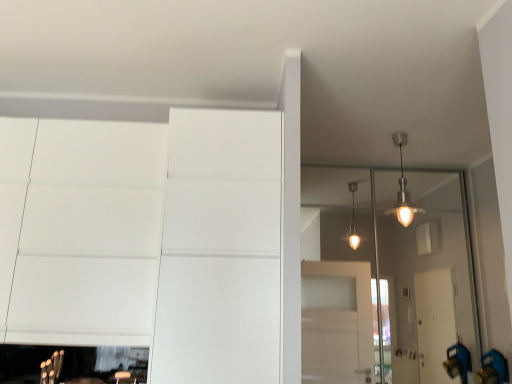
Question: Is white matte dresser at lower left taller or shorter than transparent glass door at upper right?

Choices:
 (A) short
 (B) tall

Answer: (A)

Question: From a real-world perspective, is white matte dresser at lower left above or below transparent glass door at upper right?

Choices:
 (A) below
 (B) above

Answer: (B)

Question: Is point (100, 248) closer or farther from the camera than point (453, 273)?

Choices:
 (A) farther
 (B) closer

Answer: (B)

Question: From a real-world perspective, is transparent glass door at upper right positioned above or below white matte dresser at lower left?

Choices:
 (A) above
 (B) below

Answer: (B)

Question: In terms of size, does transparent glass door at upper right appear bigger or smaller than white matte dresser at lower left?

Choices:
 (A) big
 (B) small

Answer: (B)

Question: From their relative heights in the image, would you say transparent glass door at upper right is taller or shorter than white matte dresser at lower left?

Choices:
 (A) tall
 (B) short

Answer: (A)

Question: From the image's perspective, relative to white matte dresser at lower left, is transparent glass door at upper right above or below?

Choices:
 (A) below
 (B) above

Answer: (A)